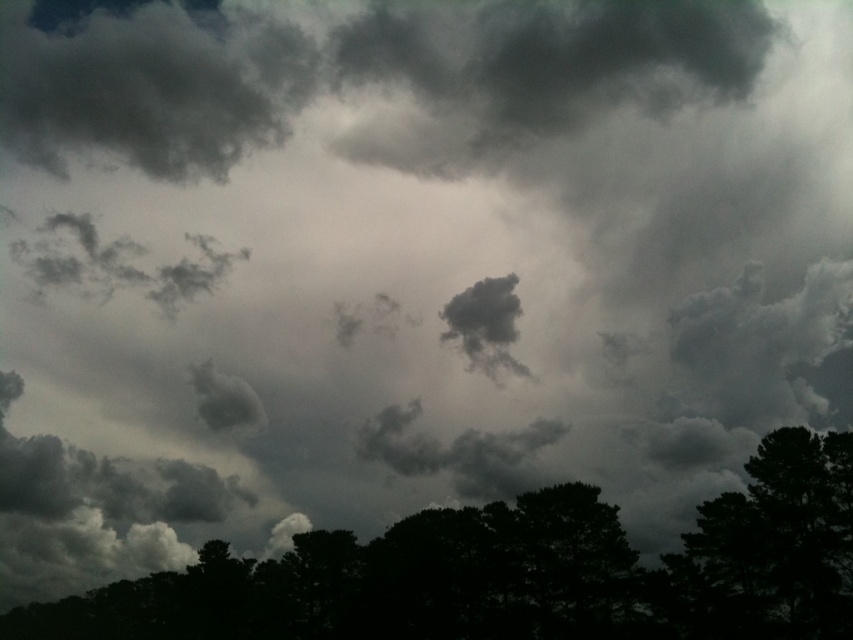
Based on the photo, you are standing in a field looking up at the sky. You see two dark green leafy trees in the distance. One is labeled as the dark green leafy tree at bottom and the other as the dark green leafy tree at lower right. Which tree is positioned more to the left when viewed from your perspective?

The dark green leafy tree at bottom is positioned more to the left compared to the dark green leafy tree at lower right.